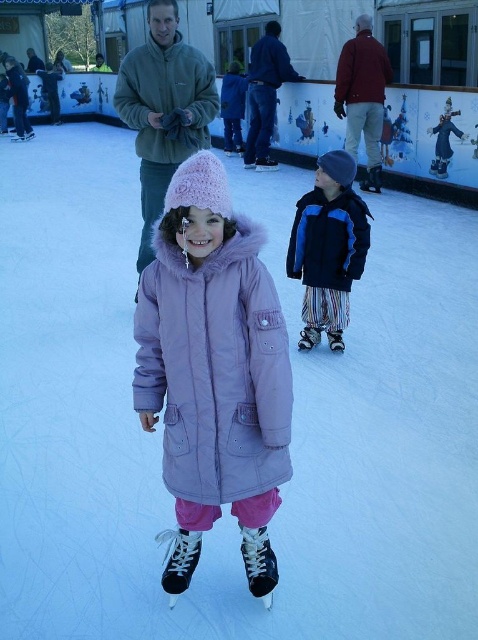
Is green fleece jacket at upper center bigger than matte red jacket at upper center?

Yes.

Measure the distance between green fleece jacket at upper center and camera.

green fleece jacket at upper center and camera are 4.16 meters apart from each other.

Locate an element on the screen. green fleece jacket at upper center is located at coordinates (163, 108).

Does point (194, 93) come farther from viewer compared to point (355, 42)?

No, it is not.

Describe the element at coordinates (163, 108) in the screenshot. I see `green fleece jacket at upper center` at that location.

Between point (152, 220) and point (369, 150), which one is positioned in front?

Point (152, 220)

Locate an element on the screen. green fleece jacket at upper center is located at coordinates (163, 108).

Can you confirm if green fleece jacket at upper center is positioned to the left of dark blue jacket at center?

Yes, green fleece jacket at upper center is to the left of dark blue jacket at center.

Which is behind, point (150, 148) or point (269, 96)?

The point (269, 96) is behind.

I want to click on green fleece jacket at upper center, so click(163, 108).

Locate an element on the screen. The height and width of the screenshot is (640, 478). green fleece jacket at upper center is located at coordinates (163, 108).